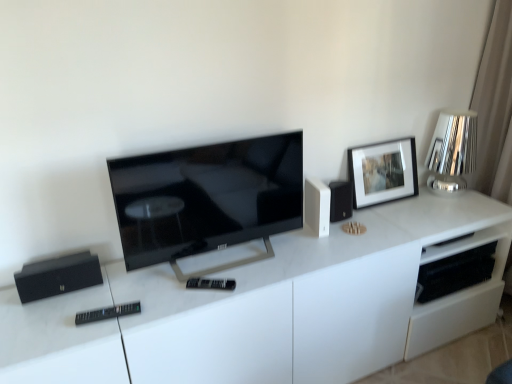
I want to click on vacant area that lies between black plastic remote at center, placed as the second remote when sorted from left to right, and matte black tv at center, so click(242, 278).